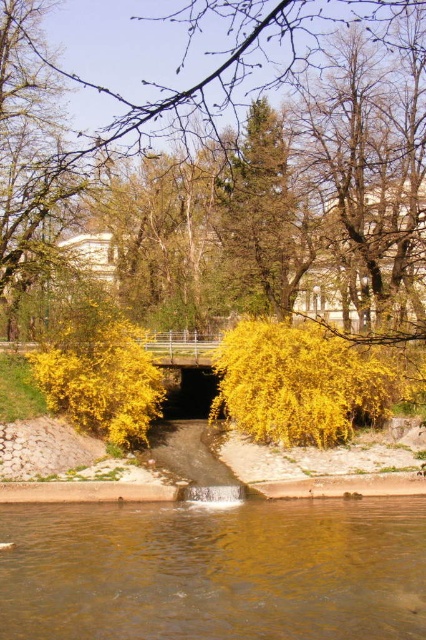
You are a hiker who wants to cross the brown liquid water at lower center. To your left, there is a yellow leafy tree at center. Which direction should you head towards to find a stable path?

The brown liquid water at lower center is positioned on the right side of yellow leafy tree at center. Therefore, to find a stable path, you should head towards the left side of the yellow leafy tree at center, away from the water.

You are a hiker standing at the edge of the brown liquid water at lower center and want to take a photo of the yellow leafy tree at center. Which direction should you face to ensure the tree is fully visible in your camera frame?

The yellow leafy tree at center is taller than the brown liquid water at lower center, so you should face upward to ensure the tree is fully visible in your camera frame.